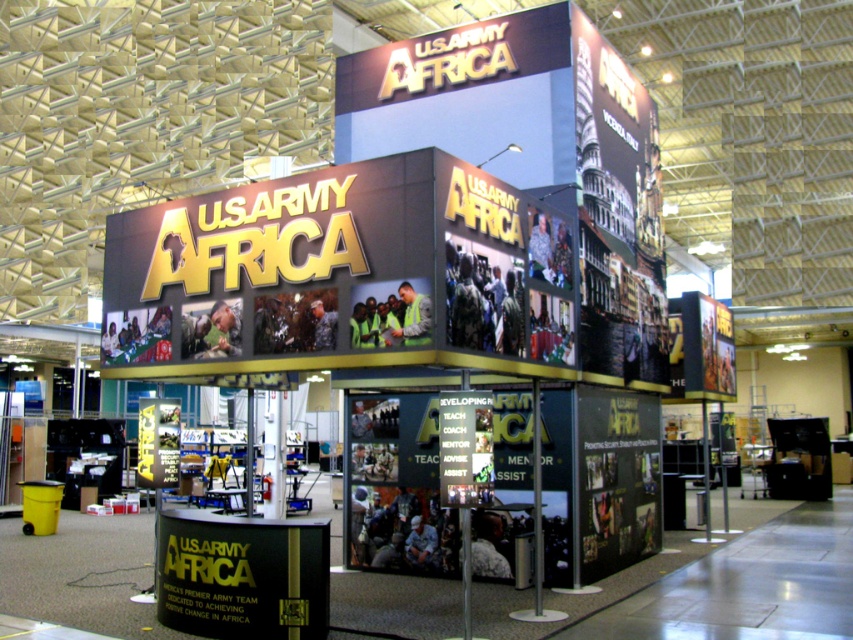
Question: Which object appears farthest from the camera in this image?

Choices:
 (A) black matte sign at center
 (B) matte gold sign at center

Answer: (A)

Question: Which object appears farthest from the camera in this image?

Choices:
 (A) matte gold sign at center
 (B) black matte sign at center

Answer: (B)

Question: Considering the relative positions of matte gold sign at center and black matte sign at center in the image provided, where is matte gold sign at center located with respect to black matte sign at center?

Choices:
 (A) left
 (B) right

Answer: (B)

Question: Is matte gold sign at center in front of black matte sign at center?

Choices:
 (A) no
 (B) yes

Answer: (B)

Question: Can you confirm if matte gold sign at center is positioned below black matte sign at center?

Choices:
 (A) no
 (B) yes

Answer: (A)